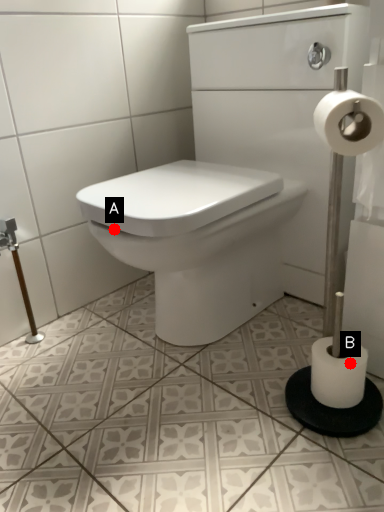
Question: Two points are circled on the image, labeled by A and B beside each circle. Which point appears closest to the camera in this image?

Choices:
 (A) A is closer
 (B) B is closer

Answer: (B)